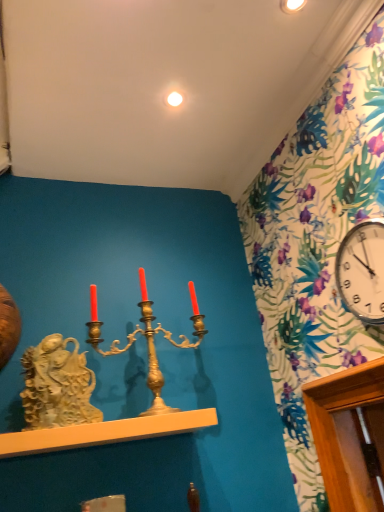
Question: Does smooth white shelf at center have a lesser width compared to white glossy clock at upper right?

Choices:
 (A) yes
 (B) no

Answer: (B)

Question: Is smooth white shelf at center aimed at white glossy clock at upper right?

Choices:
 (A) yes
 (B) no

Answer: (B)

Question: Can you confirm if smooth white shelf at center is shorter than white glossy clock at upper right?

Choices:
 (A) no
 (B) yes

Answer: (B)

Question: Is smooth white shelf at center positioned with its back to white glossy clock at upper right?

Choices:
 (A) yes
 (B) no

Answer: (B)

Question: Does smooth white shelf at center have a greater height compared to white glossy clock at upper right?

Choices:
 (A) no
 (B) yes

Answer: (A)

Question: Does smooth white shelf at center come in front of white glossy clock at upper right?

Choices:
 (A) no
 (B) yes

Answer: (A)

Question: Is white glossy clock at upper right not within gold metallic candle holder at center?

Choices:
 (A) yes
 (B) no

Answer: (A)

Question: Does white glossy clock at upper right have a larger size compared to gold metallic candle holder at center?

Choices:
 (A) yes
 (B) no

Answer: (B)

Question: Is white glossy clock at upper right positioned with its back to gold metallic candle holder at center?

Choices:
 (A) no
 (B) yes

Answer: (A)

Question: Does white glossy clock at upper right contain gold metallic candle holder at center?

Choices:
 (A) yes
 (B) no

Answer: (B)

Question: Are white glossy clock at upper right and gold metallic candle holder at center far apart?

Choices:
 (A) no
 (B) yes

Answer: (A)

Question: From the image's perspective, is white glossy clock at upper right under gold metallic candle holder at center?

Choices:
 (A) no
 (B) yes

Answer: (A)

Question: Is white glossy clock at upper right facing towards white glossy light bulb at upper center?

Choices:
 (A) yes
 (B) no

Answer: (B)